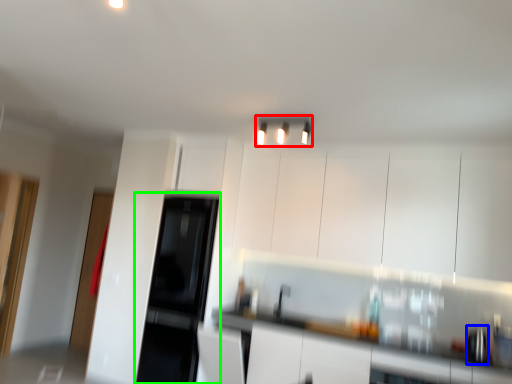
Question: Which object is the closest to the light fixture (highlighted by a red box)? Choose among these: appliance (highlighted by a blue box) or appliance (highlighted by a green box).

Choices:
 (A) appliance
 (B) appliance

Answer: (A)